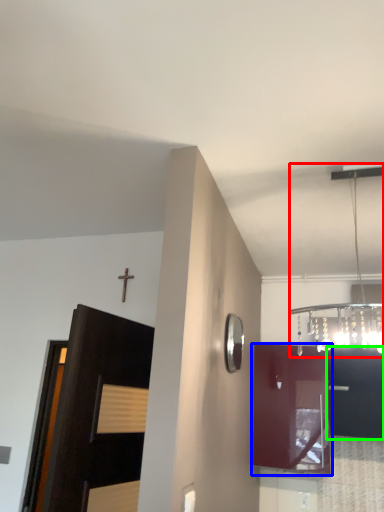
Question: Which is farther away from light fixture (highlighted by a red box)? cabinetry (highlighted by a blue box) or cabinetry (highlighted by a green box)?

Choices:
 (A) cabinetry
 (B) cabinetry

Answer: (A)